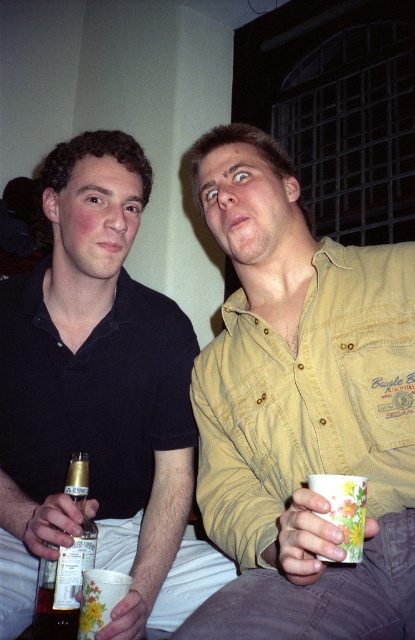
What do you see at coordinates (99, 401) in the screenshot?
I see `matte black shirt at left` at bounding box center [99, 401].

Which is below, matte black shirt at left or gold foil beer bottle at lower left?

gold foil beer bottle at lower left is lower down.

Image resolution: width=415 pixels, height=640 pixels. In order to click on matte black shirt at left in this screenshot , I will do `click(99, 401)`.

Is point (273, 204) behind point (41, 467)?

No, (273, 204) is closer to viewer.

Where is `yellow cotton shirt at upper right`? yellow cotton shirt at upper right is located at coordinates (300, 410).

Between point (270, 401) and point (70, 580), which one is positioned behind?

The point (270, 401) is more distant.

Where is `yellow cotton shirt at upper right`? This screenshot has height=640, width=415. yellow cotton shirt at upper right is located at coordinates (300, 410).

Is point (287, 504) positioned before point (82, 563)?

Yes, point (287, 504) is closer to viewer.

Where is `yellow cotton shirt at upper right`? yellow cotton shirt at upper right is located at coordinates (300, 410).